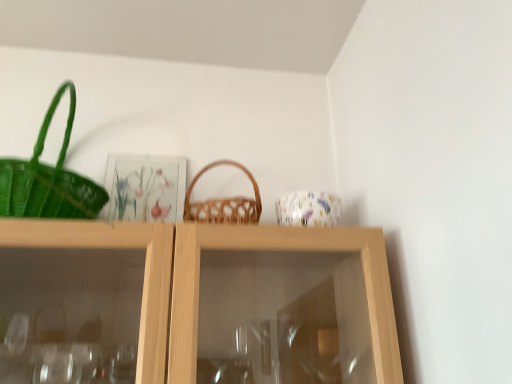
What do you see at coordinates (308, 209) in the screenshot? I see `floral-patterned ceramic cup at upper center` at bounding box center [308, 209].

Locate an element on the screen. floral-patterned ceramic cup at upper center is located at coordinates point(308,209).

What do you see at coordinates (224, 202) in the screenshot?
I see `woven brown picnic basket at center` at bounding box center [224, 202].

Measure the distance between point (216, 221) and camera.

Point (216, 221) is 91.70 centimeters away from camera.

Where is `woven brown picnic basket at center`? woven brown picnic basket at center is located at coordinates (224, 202).

Identify the location of floral-patterned ceramic cup at upper center. (308, 209).

Would you say woven brown picnic basket at center is to the left or to the right of floral-patterned ceramic cup at upper center in the picture?

In the image, woven brown picnic basket at center appears on the left side of floral-patterned ceramic cup at upper center.

Is woven brown picnic basket at center further to camera compared to floral-patterned ceramic cup at upper center?

No, it is in front of floral-patterned ceramic cup at upper center.

Considering the positions of points (231, 222) and (314, 194), is point (231, 222) closer to camera compared to point (314, 194)?

Yes.

From the image's perspective, is woven brown picnic basket at center above or below floral-patterned ceramic cup at upper center?

woven brown picnic basket at center is situated higher than floral-patterned ceramic cup at upper center in the image.

From a real-world perspective, which object rests below the other?

In real-world perspective, floral-patterned ceramic cup at upper center is lower.

Is woven brown picnic basket at center wider than floral-patterned ceramic cup at upper center?

Yes, woven brown picnic basket at center is wider than floral-patterned ceramic cup at upper center.

Between woven brown picnic basket at center and floral-patterned ceramic cup at upper center, which one has less height?

With less height is floral-patterned ceramic cup at upper center.

Between woven brown picnic basket at center and floral-patterned ceramic cup at upper center, which one has larger size?

woven brown picnic basket at center.

Is woven brown picnic basket at center spatially inside floral-patterned ceramic cup at upper center, or outside of it?

woven brown picnic basket at center is not enclosed by floral-patterned ceramic cup at upper center.

Is woven brown picnic basket at center far from floral-patterned ceramic cup at upper center?

No.

Is woven brown picnic basket at center looking in the opposite direction of floral-patterned ceramic cup at upper center?

No, floral-patterned ceramic cup at upper center is not at the back of woven brown picnic basket at center.

What's the angular difference between woven brown picnic basket at center and floral-patterned ceramic cup at upper center's facing directions?

8.01 degrees separate the facing orientations of woven brown picnic basket at center and floral-patterned ceramic cup at upper center.

This screenshot has width=512, height=384. Identify the location of tableware below the woven brown picnic basket at center (from a real-world perspective). (308, 209).

Considering the relative positions of floral-patterned ceramic cup at upper center and woven brown picnic basket at center in the image provided, is floral-patterned ceramic cup at upper center to the left or to the right of woven brown picnic basket at center?

floral-patterned ceramic cup at upper center is positioned on woven brown picnic basket at center's right side.

Does floral-patterned ceramic cup at upper center lie in front of woven brown picnic basket at center?

No, floral-patterned ceramic cup at upper center is behind woven brown picnic basket at center.

Considering the points (275, 204) and (219, 212), which point is in front, point (275, 204) or point (219, 212)?

Point (219, 212)

From the image's perspective, is floral-patterned ceramic cup at upper center positioned above or below woven brown picnic basket at center?

Based on their image positions, floral-patterned ceramic cup at upper center is located beneath woven brown picnic basket at center.

In the scene shown: From a real-world perspective, is floral-patterned ceramic cup at upper center physically below woven brown picnic basket at center?

Indeed, from a real-world perspective, floral-patterned ceramic cup at upper center is positioned beneath woven brown picnic basket at center.

In terms of width, does floral-patterned ceramic cup at upper center look wider or thinner when compared to woven brown picnic basket at center?

In the image, floral-patterned ceramic cup at upper center appears to be more narrow than woven brown picnic basket at center.

Can you confirm if floral-patterned ceramic cup at upper center is shorter than woven brown picnic basket at center?

Indeed, floral-patterned ceramic cup at upper center has a lesser height compared to woven brown picnic basket at center.

Considering the relative sizes of floral-patterned ceramic cup at upper center and woven brown picnic basket at center in the image provided, is floral-patterned ceramic cup at upper center smaller than woven brown picnic basket at center?

Yes.

Is floral-patterned ceramic cup at upper center located outside woven brown picnic basket at center?

Absolutely, floral-patterned ceramic cup at upper center is external to woven brown picnic basket at center.

Is floral-patterned ceramic cup at upper center far from woven brown picnic basket at center?

floral-patterned ceramic cup at upper center is actually quite close to woven brown picnic basket at center.

Could you tell me if floral-patterned ceramic cup at upper center is turned towards woven brown picnic basket at center?

No, floral-patterned ceramic cup at upper center is not oriented towards woven brown picnic basket at center.

How many degrees apart are the facing directions of floral-patterned ceramic cup at upper center and woven brown picnic basket at center?

The facing directions of floral-patterned ceramic cup at upper center and woven brown picnic basket at center are 8.01 degrees apart.

How distant is floral-patterned ceramic cup at upper center from woven brown picnic basket at center?

floral-patterned ceramic cup at upper center and woven brown picnic basket at center are 5.48 inches apart.

Locate an element on the screen. This screenshot has height=384, width=512. picnic basket lying on the left of floral-patterned ceramic cup at upper center is located at coordinates (224, 202).

Locate an element on the screen. This screenshot has width=512, height=384. tableware below the woven brown picnic basket at center (from the image's perspective) is located at coordinates (308, 209).

Locate an element on the screen. This screenshot has height=384, width=512. picnic basket above the floral-patterned ceramic cup at upper center (from a real-world perspective) is located at coordinates (224, 202).